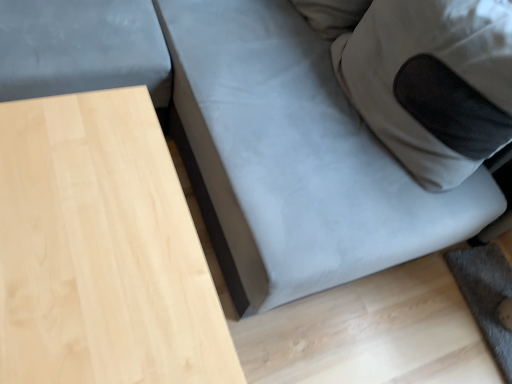
Identify the location of free location above natural wood table at left (from a real-world perspective). The width and height of the screenshot is (512, 384). (91, 241).